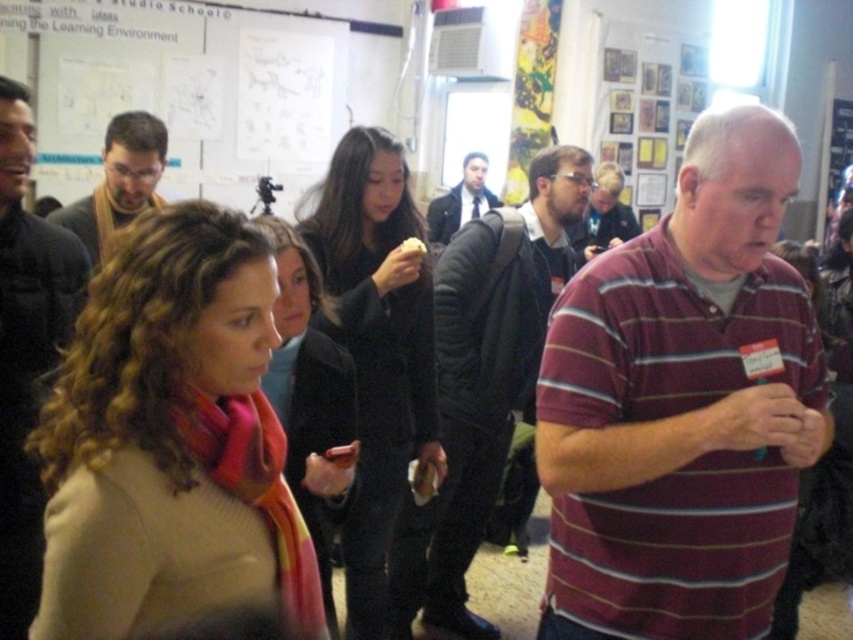
Can you confirm if dark gray jacket at center is positioned below black matte coat at center?

Indeed, dark gray jacket at center is positioned under black matte coat at center.

Which is above, dark gray jacket at center or black matte coat at center?

black matte coat at center is above.

The width and height of the screenshot is (853, 640). Identify the location of dark gray jacket at center. (490, 365).

Which is below, dark brown leather jacket at center or multicolored scarf at center?

Positioned lower is multicolored scarf at center.

What do you see at coordinates (26, 353) in the screenshot?
I see `dark brown leather jacket at center` at bounding box center [26, 353].

Find the location of `dark brown leather jacket at center`. dark brown leather jacket at center is located at coordinates (26, 353).

Based on the photo, is dark gray jacket at center wider than dark suit jacket at center?

Yes, dark gray jacket at center is wider than dark suit jacket at center.

Can you confirm if dark gray jacket at center is positioned above dark suit jacket at center?

No, dark gray jacket at center is not above dark suit jacket at center.

At what (x,y) coordinates should I click in order to perform the action: click on dark gray jacket at center. Please return your answer as a coordinate pair (x, y). Looking at the image, I should click on (490, 365).